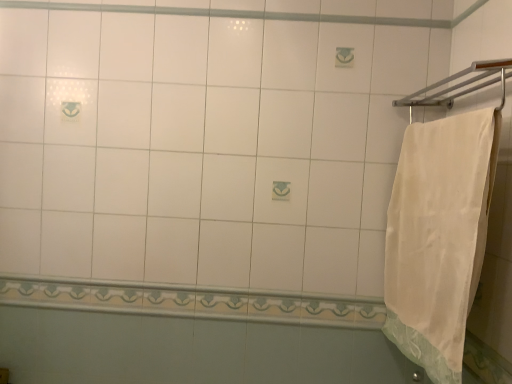
Question: Is white cotton towel at right closer to camera compared to silver metallic towel bar at upper right?

Choices:
 (A) no
 (B) yes

Answer: (A)

Question: Is silver metallic towel bar at upper right completely or partially inside white cotton towel at right?

Choices:
 (A) no
 (B) yes

Answer: (A)

Question: Does white cotton towel at right turn towards silver metallic towel bar at upper right?

Choices:
 (A) yes
 (B) no

Answer: (B)

Question: Is white cotton towel at right shorter than silver metallic towel bar at upper right?

Choices:
 (A) yes
 (B) no

Answer: (B)

Question: Does white cotton towel at right have a lesser width compared to silver metallic towel bar at upper right?

Choices:
 (A) yes
 (B) no

Answer: (A)

Question: Is the depth of white cotton towel at right greater than that of silver metallic towel bar at upper right?

Choices:
 (A) yes
 (B) no

Answer: (A)

Question: Could you tell me if white glossy tile at lower center is facing white cotton towel at right?

Choices:
 (A) no
 (B) yes

Answer: (A)

Question: From the image's perspective, does white glossy tile at lower center appear lower than white cotton towel at right?

Choices:
 (A) no
 (B) yes

Answer: (B)

Question: Can you confirm if white glossy tile at lower center is smaller than white cotton towel at right?

Choices:
 (A) yes
 (B) no

Answer: (A)

Question: Is white cotton towel at right completely or partially inside white glossy tile at lower center?

Choices:
 (A) yes
 (B) no

Answer: (B)

Question: Does white glossy tile at lower center appear on the left side of white cotton towel at right?

Choices:
 (A) yes
 (B) no

Answer: (A)

Question: From a real-world perspective, is white glossy tile at lower center under white cotton towel at right?

Choices:
 (A) no
 (B) yes

Answer: (B)

Question: Is silver metallic towel bar at upper right positioned behind white cotton towel at right?

Choices:
 (A) yes
 (B) no

Answer: (B)